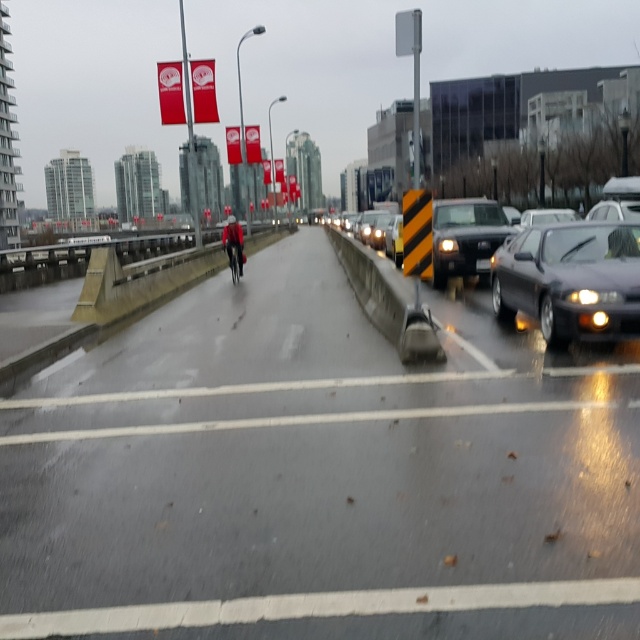
From the picture: You are a pedestrian standing at point (436, 272) and want to cross the bridge to reach point (632, 632). However, there are vehicles moving slowly on the right side of the bridge. Can you safely walk from your current position to the destination without crossing any moving vehicles?

Point (632, 632) is in front of point (436, 272), so you can safely walk to the destination without crossing any moving vehicles as long as you follow the path directly ahead.

From the picture: You are a pedestrian trying to cross the bridge from the left side to the right side. You see a shiny black sedan at right and a matte black suv at center. Which vehicle is closer to you as you approach the right side of the bridge?

The shiny black sedan at right is closer to you as you approach the right side of the bridge because it is positioned at the right side near the edge, while the matte black suv at center is located towards the middle of the bridge.